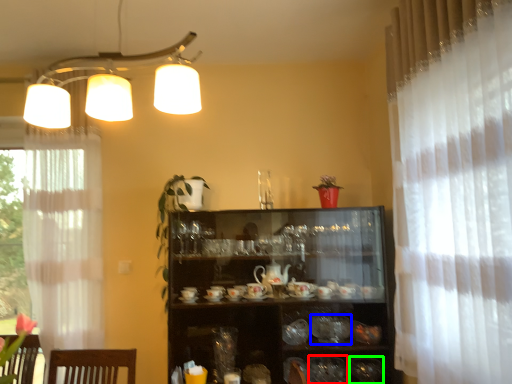
Question: Which is farther away from tableware (highlighted by a red box)? tableware (highlighted by a blue box) or tableware (highlighted by a green box)?

Choices:
 (A) tableware
 (B) tableware

Answer: (A)